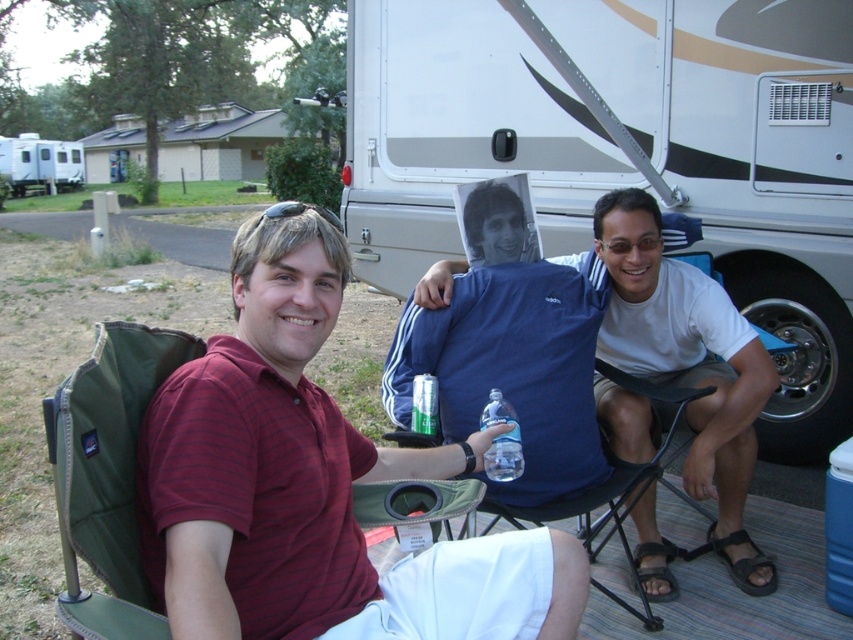
Question: Which object appears farthest from the camera in this image?

Choices:
 (A) black leather sandal at lower right
 (B) maroon striped shirt at center
 (C) clear plastic bottle at center
 (D) blue cotton t-shirt at center

Answer: (A)

Question: Does green fabric chair at lower left appear over black leather sandal at lower right?

Choices:
 (A) yes
 (B) no

Answer: (A)

Question: Is the position of white plastic trailer at upper left more distant than that of green metallic can at center?

Choices:
 (A) yes
 (B) no

Answer: (A)

Question: Which point is farther to the camera?

Choices:
 (A) white glossy recreational vehicle at center
 (B) clear plastic bottle at center

Answer: (A)

Question: Can you confirm if white glossy recreational vehicle at center is bigger than green fabric chair at lower left?

Choices:
 (A) yes
 (B) no

Answer: (A)

Question: Which point appears closest to the camera in this image?

Choices:
 (A) (415, 250)
 (B) (54, 141)
 (C) (660, 593)
 (D) (747, 577)

Answer: (C)